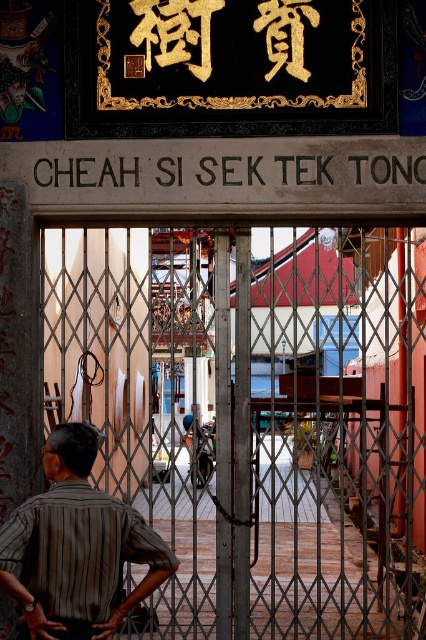
You are standing at the entrance of the temple and notice a person wearing a brown striped shirt at center and a black stone sign at center. Which object is wider?

The brown striped shirt at center is less wide than the black stone sign at center.

You are standing at the entrance of a traditional building with a partially open metallic gate. There is a point marked at coordinates (253, 419). What object is located at this point?

The metallic gate at center is located at point (253, 419).

You are standing at the entrance of the temple and want to walk towards the two points marked in the courtyard. Which point, point [316,337] or point [62,451], will you reach first?

You will reach point [62,451] first because it is closer to you than point [316,337], which is further away.